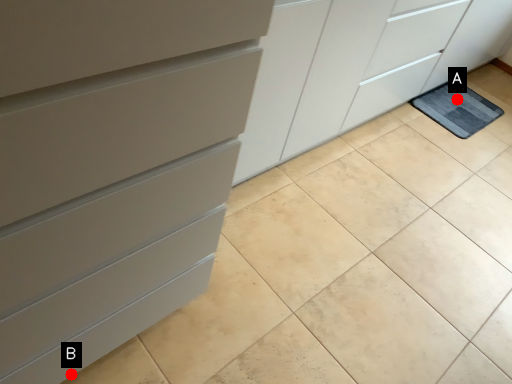
Question: Two points are circled on the image, labeled by A and B beside each circle. Which of the following is the closest to the observer?

Choices:
 (A) A is closer
 (B) B is closer

Answer: (B)